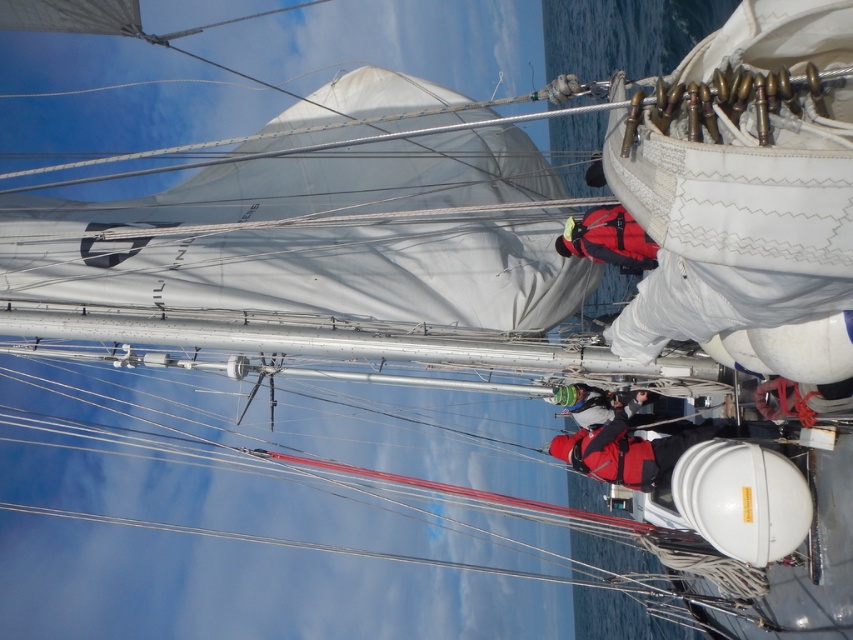
You are a photographer on the deck of the boat and you notice two items at the center of your viewfinder. One is the red fabric jacket at center and the other is the green knitted hat at center. Which item would appear larger in your photo?

The red fabric jacket at center appears larger in the photo because it is bigger than the green knitted hat at center.

You are a photographer on the deck of the sailing vessel and want to capture both the red fabric jacket at center and the green knitted hat at center in a single photo. Since the camera can only focus on one subject at a time, which object should you focus on to ensure the taller one is sharp?

The red fabric jacket at center is taller than the green knitted hat at center, so you should focus on the red fabric jacket at center to ensure the taller one is sharp.